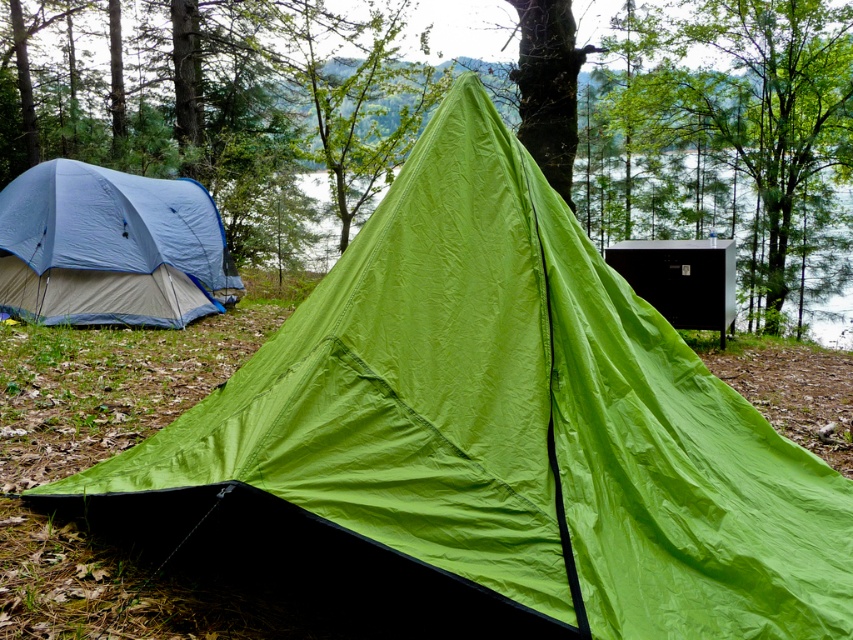
Based on the scene description, where is the green matte tree at upper right located in the image?

The green matte tree at upper right is located at point (753, 115) in the image.

You are a hiker who wants to take a photo of the green fabric tent at center and the green matte tree at upper right. Since you want both subjects in focus, which one should you position closer to the camera to ensure clarity?

The green fabric tent at center is closer to the viewer than the green matte tree at upper right, so you should position the green fabric tent at center closer to the camera to ensure both are in focus.

You are a camper who wants to choose a tent with more vertical space inside for standing upright. Based on the scene, which tent between the green fabric tent at center and the matte blue tent at left would you recommend?

The green fabric tent at center has a greater height compared to the matte blue tent at left, so it provides more vertical space for standing upright.